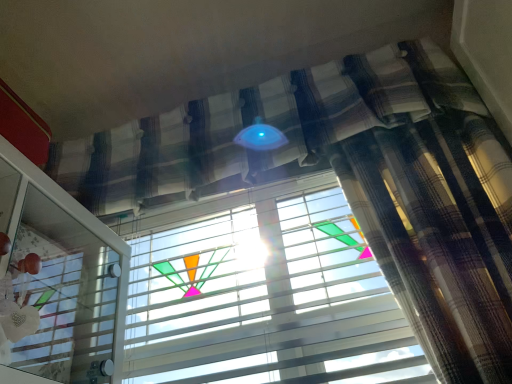
Question: From their relative heights in the image, would you say white plastic blinds at center is taller or shorter than transparent glass screen door at lower left?

Choices:
 (A) tall
 (B) short

Answer: (A)

Question: Considering the positions of white plastic blinds at center and transparent glass screen door at lower left in the image, is white plastic blinds at center bigger or smaller than transparent glass screen door at lower left?

Choices:
 (A) big
 (B) small

Answer: (B)

Question: Which is correct: white plastic blinds at center is inside transparent glass screen door at lower left, or outside of it?

Choices:
 (A) outside
 (B) inside

Answer: (A)

Question: In terms of height, does transparent glass screen door at lower left look taller or shorter compared to white plastic blinds at center?

Choices:
 (A) tall
 (B) short

Answer: (B)

Question: Is transparent glass screen door at lower left to the left or to the right of white plastic blinds at center in the image?

Choices:
 (A) right
 (B) left

Answer: (B)

Question: Is transparent glass screen door at lower left in front of or behind white plastic blinds at center in the image?

Choices:
 (A) behind
 (B) front

Answer: (B)

Question: From the image's perspective, is transparent glass screen door at lower left located above or below white plastic blinds at center?

Choices:
 (A) below
 (B) above

Answer: (B)